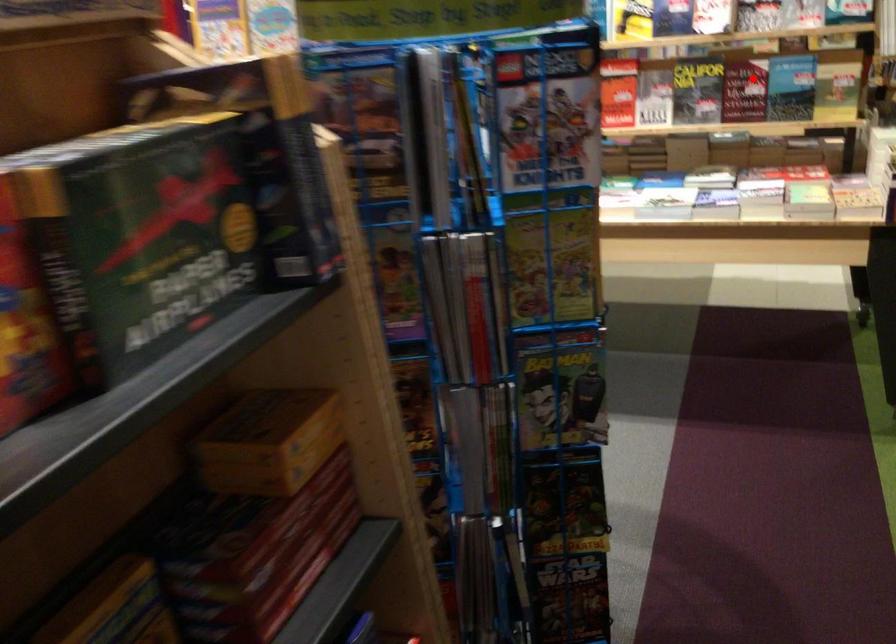
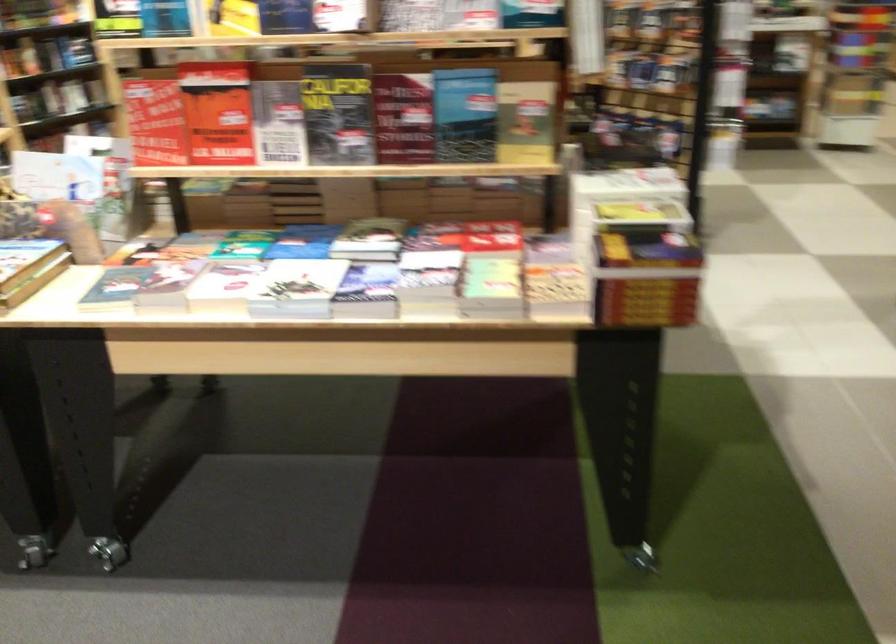
Question: A red point is marked in image1. In image2, is the corresponding 3D point closer to the camera or farther? Reply with the corresponding letter.

Choices:
 (A) The corresponding 3D point is closer.
 (B) The corresponding 3D point is farther.

Answer: (A)